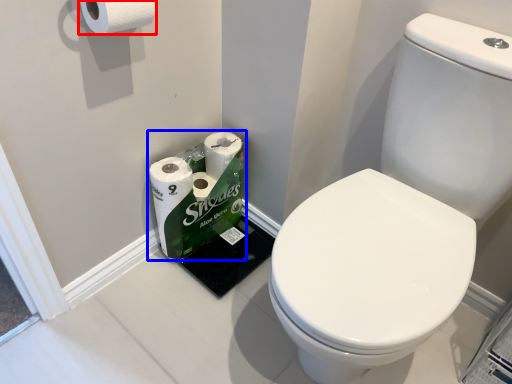
Question: Among these objects, which one is nearest to the camera, toilet paper (highlighted by a red box) or toilet paper (highlighted by a blue box)?

Choices:
 (A) toilet paper
 (B) toilet paper

Answer: (A)